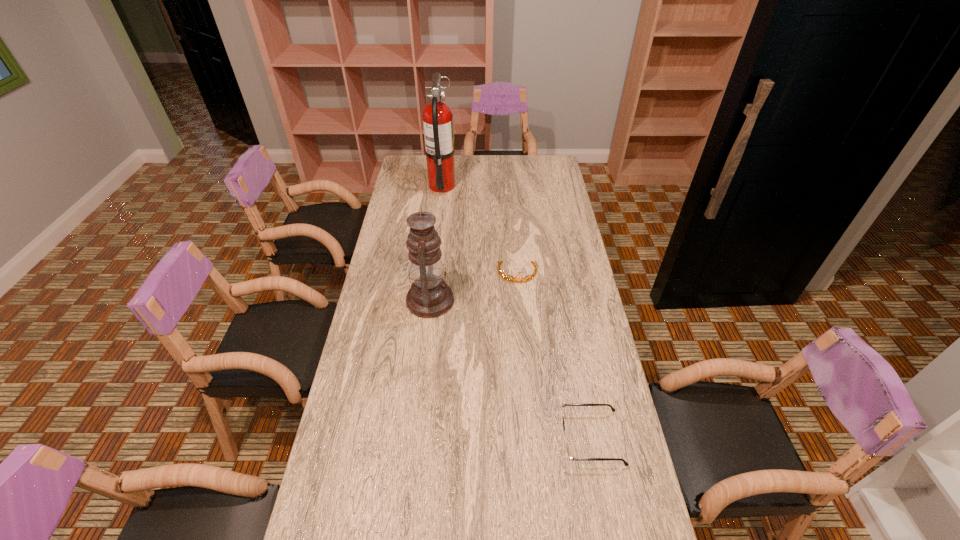
Identify the location of free spot located at the hinge ends of the nearest object. (522, 439).

The width and height of the screenshot is (960, 540). I want to click on vacant space situated at the hinge ends of the nearest object, so click(441, 439).

In order to click on blank area located at the hinge ends of the nearest object in this screenshot , I will do `click(543, 439)`.

This screenshot has height=540, width=960. In order to click on object at the far edge in this screenshot , I will do `click(438, 126)`.

The image size is (960, 540). Find the location of `fire extinguisher present at the left edge`. fire extinguisher present at the left edge is located at coordinates (438, 126).

Identify the location of oil lamp that is at the left edge. This screenshot has width=960, height=540. (429, 296).

I want to click on object that is at the right edge, so click(x=569, y=455).

Locate an element on the screen. object present at the far left corner is located at coordinates (438, 126).

Where is `vacant space at the far edge of the desktop`? The width and height of the screenshot is (960, 540). vacant space at the far edge of the desktop is located at coordinates (511, 160).

Image resolution: width=960 pixels, height=540 pixels. What are the coordinates of `blank space at the left edge of the desktop` in the screenshot? It's located at (383, 444).